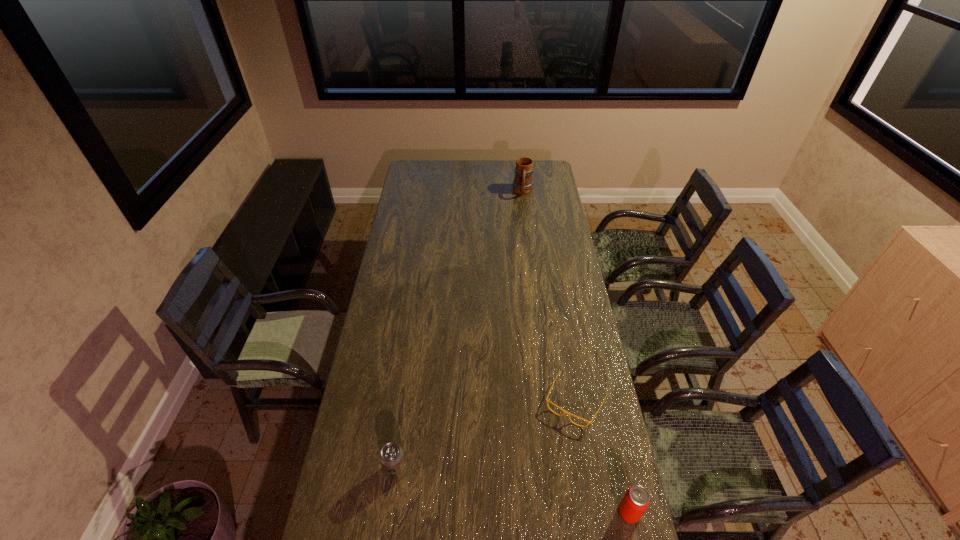
Locate an element on the screen. the farther beer can is located at coordinates (391, 456).

Locate an element on the screen. This screenshot has width=960, height=540. the left beer can is located at coordinates (391, 456).

Locate an element on the screen. The width and height of the screenshot is (960, 540). the nearest object is located at coordinates (636, 500).

This screenshot has height=540, width=960. I want to click on the right beer can, so click(636, 500).

Locate an element on the screen. Image resolution: width=960 pixels, height=540 pixels. the shortest object is located at coordinates (565, 412).

Find the location of a particular element. spectacles is located at coordinates (565, 412).

The height and width of the screenshot is (540, 960). I want to click on mug, so click(522, 184).

The height and width of the screenshot is (540, 960). In order to click on the tallest object in this screenshot , I will do `click(522, 184)`.

Where is `free location located 0.080m on the back of the farther beer can`? The image size is (960, 540). free location located 0.080m on the back of the farther beer can is located at coordinates (400, 436).

The image size is (960, 540). I want to click on vacant area situated 0.320m on the back of the nearest object, so click(605, 406).